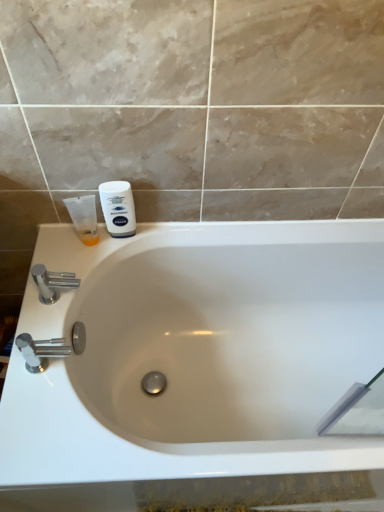
The width and height of the screenshot is (384, 512). I want to click on vacant area that lies between translucent orange tube at left, which appears as the 1th shaving cream when viewed from the left, and chrome metallic faucet at left, the second tap viewed from the front, so pyautogui.click(x=81, y=262).